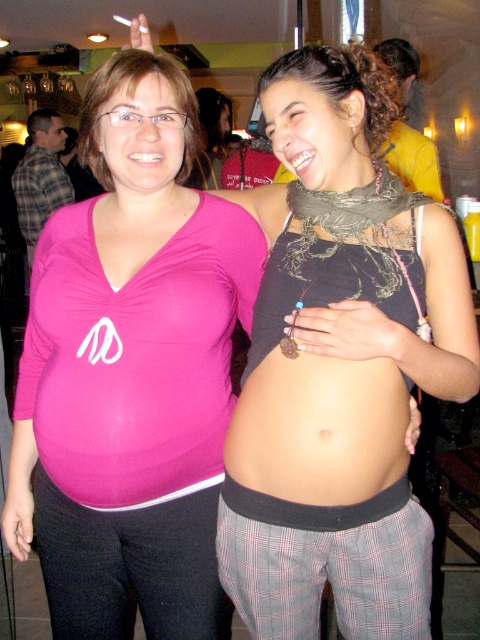
Question: Which object appears closest to the camera in this image?

Choices:
 (A) skinny beige skin at center
 (B) pink matte shirt at left

Answer: (A)

Question: From the image, what is the correct spatial relationship of matte black tank top at center in relation to pink matte shirt at left?

Choices:
 (A) below
 (B) above

Answer: (B)

Question: Which object is farther from the camera taking this photo?

Choices:
 (A) pink matte shirt at left
 (B) matte black tank top at center
 (C) skinny beige skin at center

Answer: (A)

Question: Can you confirm if pink matte shirt at left is positioned above skinny beige skin at center?

Choices:
 (A) yes
 (B) no

Answer: (A)

Question: Which point is closer to the camera?

Choices:
 (A) (241, 424)
 (B) (398, 417)

Answer: (B)

Question: Does pink matte shirt at left appear over skinny beige skin at center?

Choices:
 (A) no
 (B) yes

Answer: (B)